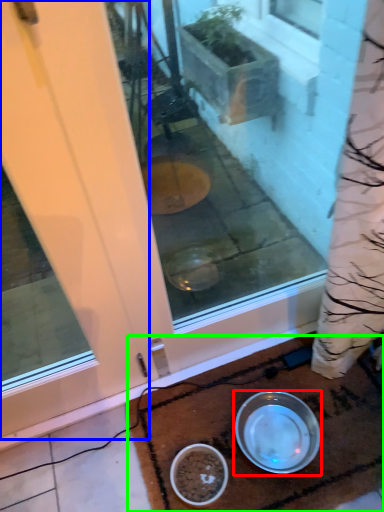
Question: Estimate the real-world distances between objects in this image. Which object is closer to bowl (highlighted by a red box), door (highlighted by a blue box) or doormat (highlighted by a green box)?

Choices:
 (A) door
 (B) doormat

Answer: (B)